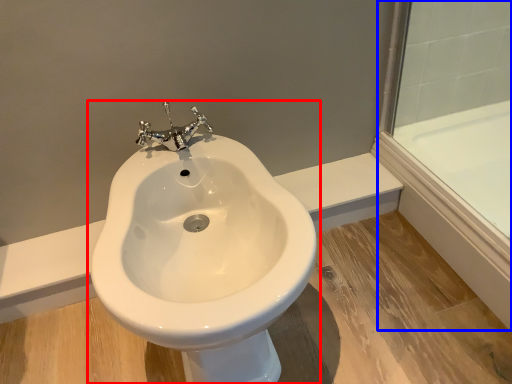
Question: Which object is further to the camera taking this photo, toilet (highlighted by a red box) or glass door (highlighted by a blue box)?

Choices:
 (A) toilet
 (B) glass door

Answer: (B)